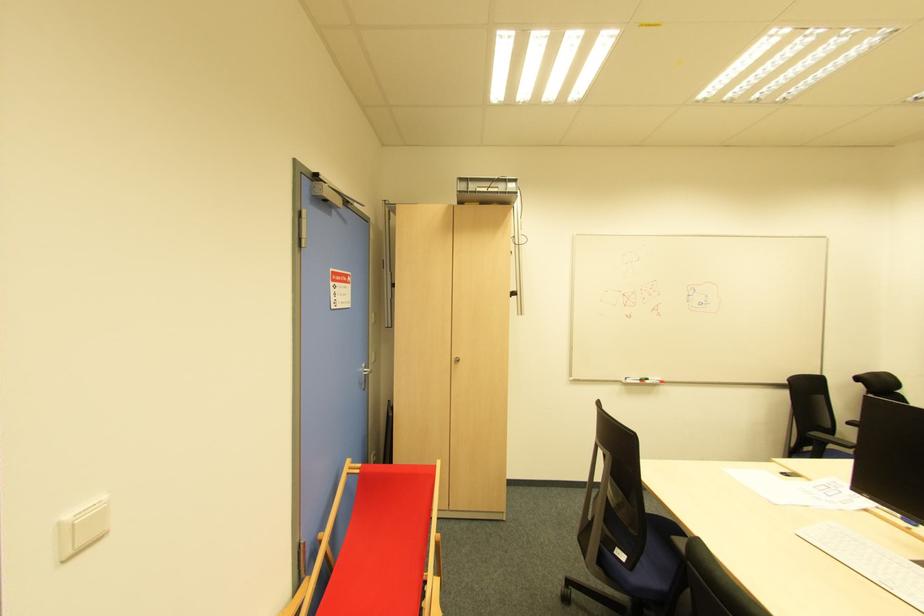
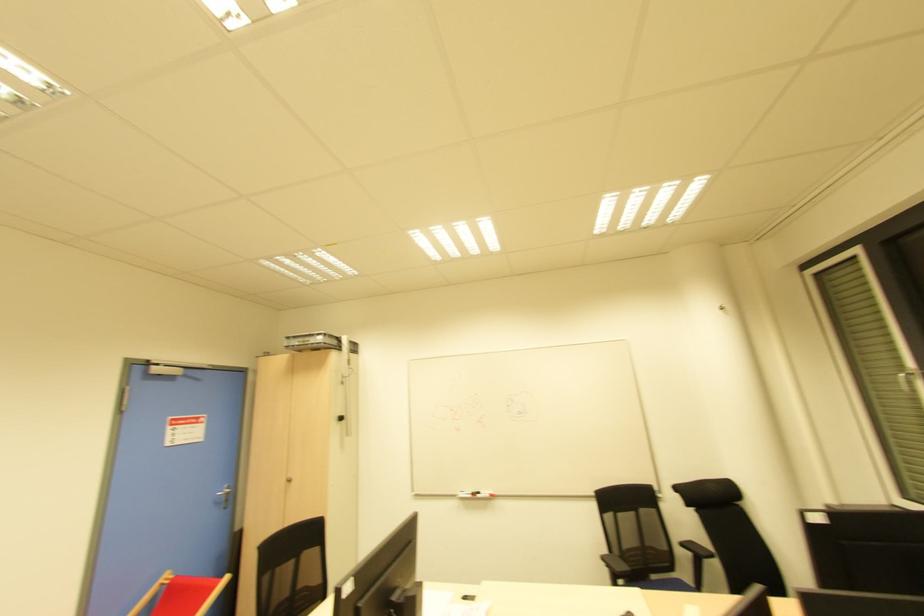
In the second image, find the point that corresponds to (458,193) in the first image.

(286, 347)